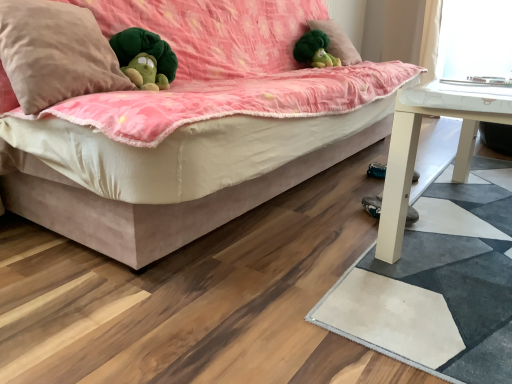
The image size is (512, 384). I want to click on vacant space situated on the left part of white matte mat at lower right, so click(259, 267).